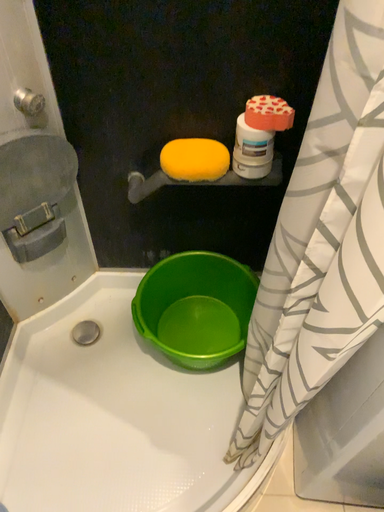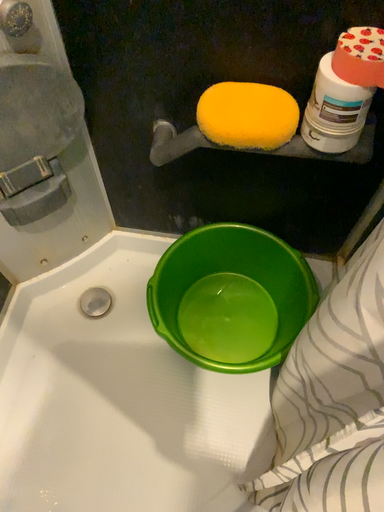
Question: How did the camera likely rotate when shooting the video?

Choices:
 (A) rotated upward
 (B) rotated downward

Answer: (B)